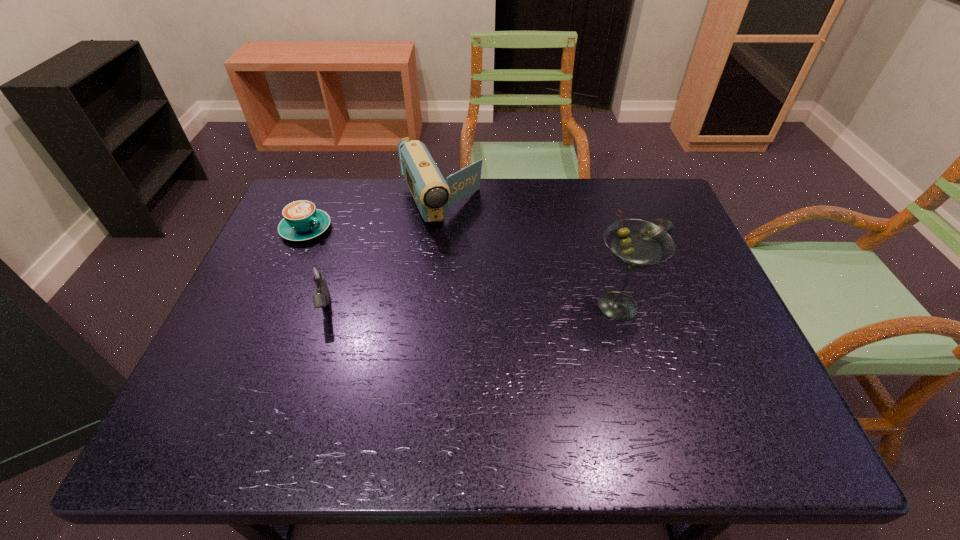
Locate an element on the screen. The width and height of the screenshot is (960, 540). vacant space at the left edge is located at coordinates (284, 259).

In the image, there is a desktop. In order to click on vacant space at the right edge in this screenshot , I will do `click(679, 327)`.

In the image, there is a desktop. At what (x,y) coordinates should I click in order to perform the action: click on free space at the near left corner. Please return your answer as a coordinate pair (x, y). Looking at the image, I should click on (211, 370).

You are a GUI agent. You are given a task and a screenshot of the screen. Output one action in this format:
    pyautogui.click(x=<x>, y=<y>)
    Task: Click on the free space at the near right corner of the desktop
    The height and width of the screenshot is (540, 960).
    Given the screenshot: What is the action you would take?
    point(742,396)

Find the location of `free space between the second shortest object and the second object from right to left`. free space between the second shortest object and the second object from right to left is located at coordinates (462, 267).

The height and width of the screenshot is (540, 960). What are the coordinates of `vacant space in between the camcorder and the rightmost object` in the screenshot? It's located at (548, 220).

The height and width of the screenshot is (540, 960). What are the coordinates of `empty space that is in between the camcorder and the shortest object` in the screenshot? It's located at (548, 220).

Identify the location of free space between the rightmost object and the cappuccino. This screenshot has height=540, width=960. (481, 231).

The width and height of the screenshot is (960, 540). I want to click on free spot between the igniter and the rightmost object, so click(490, 270).

Find the location of `unoccupied position between the fourth shortest object and the cappuccino`. unoccupied position between the fourth shortest object and the cappuccino is located at coordinates (373, 218).